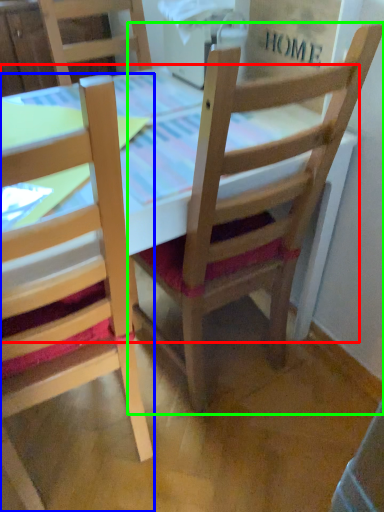
Question: Which object is the closest to the table (highlighted by a red box)? Choose among these: chair (highlighted by a blue box) or chair (highlighted by a green box).

Choices:
 (A) chair
 (B) chair

Answer: (B)